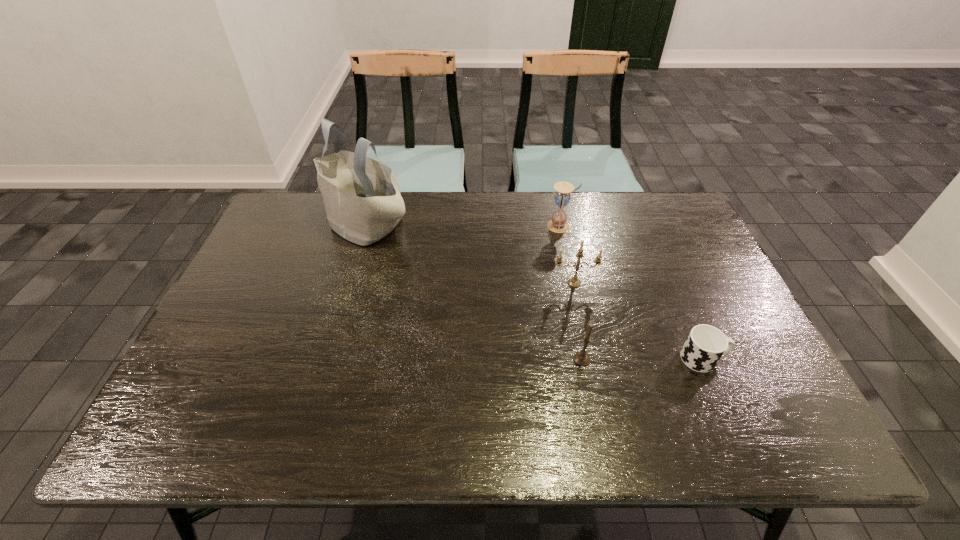
You are a GUI agent. You are given a task and a screenshot of the screen. Output one action in this format:
    pyautogui.click(x=<x>, y=<y>)
    Task: Click on the vacant space located on the front of the farther candle
    
    Given the screenshot: What is the action you would take?
    pyautogui.click(x=579, y=304)

Identify the location of vacant space located on the back of the shorter candle. The height and width of the screenshot is (540, 960). (564, 269).

Find the location of `blank space located on the side of the cup with the handle`. blank space located on the side of the cup with the handle is located at coordinates (747, 359).

Where is `shopping bag that is at the far edge`? shopping bag that is at the far edge is located at coordinates (362, 199).

Find the location of a particular element. The image size is (960, 540). hourglass that is at the far edge is located at coordinates (558, 224).

Locate an element on the screen. The image size is (960, 540). object situated at the left edge is located at coordinates (362, 199).

I want to click on object that is at the right edge, so (705, 345).

You are a GUI agent. You are given a task and a screenshot of the screen. Output one action in this format:
    pyautogui.click(x=<x>, y=<y>)
    Task: Click on the object that is at the far left corner
    The height and width of the screenshot is (540, 960).
    Given the screenshot: What is the action you would take?
    pyautogui.click(x=362, y=199)

The height and width of the screenshot is (540, 960). What are the coordinates of `vacant point at the far edge` in the screenshot? It's located at (548, 199).

Image resolution: width=960 pixels, height=540 pixels. Identify the location of vacant area at the near edge of the desktop. (358, 409).